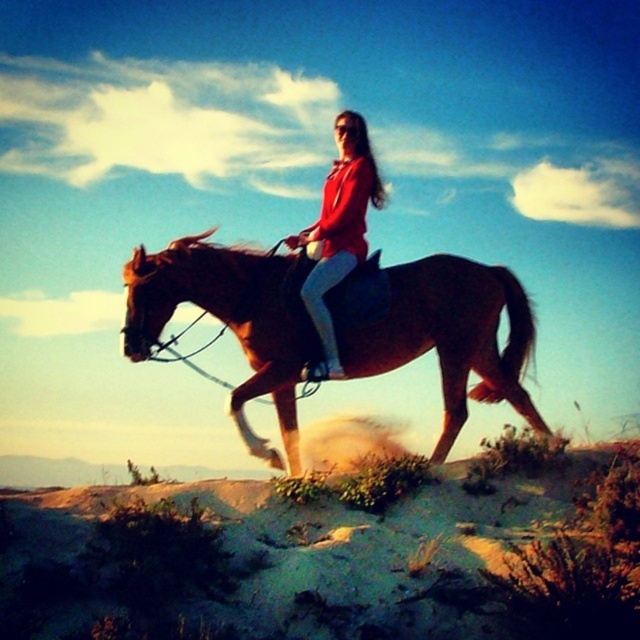
Can you confirm if brown glossy horse at center is thinner than matte red jacket at center?

No.

Can you confirm if brown glossy horse at center is wider than matte red jacket at center?

Indeed, brown glossy horse at center has a greater width compared to matte red jacket at center.

Between point (529, 348) and point (346, 209), which one is positioned in front?

Positioned in front is point (346, 209).

Image resolution: width=640 pixels, height=640 pixels. I want to click on brown glossy horse at center, so click(x=440, y=332).